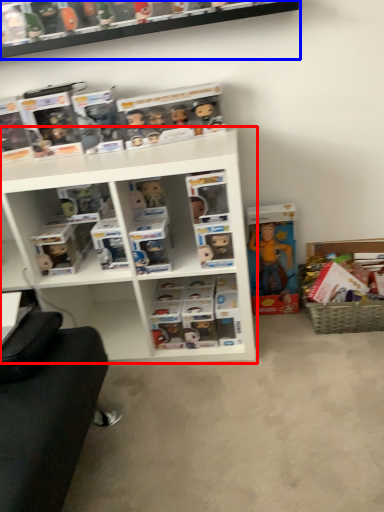
Question: Among these objects, which one is nearest to the camera, shelf (highlighted by a red box) or shelf (highlighted by a blue box)?

Choices:
 (A) shelf
 (B) shelf

Answer: (A)